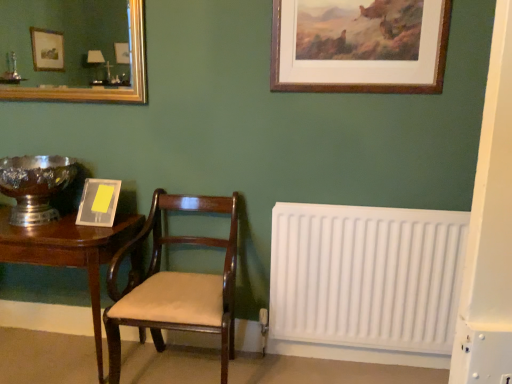
Where is `vacant space underneath mahogany wood table at left (from a real-world perspective)`? Image resolution: width=512 pixels, height=384 pixels. vacant space underneath mahogany wood table at left (from a real-world perspective) is located at coordinates (51, 359).